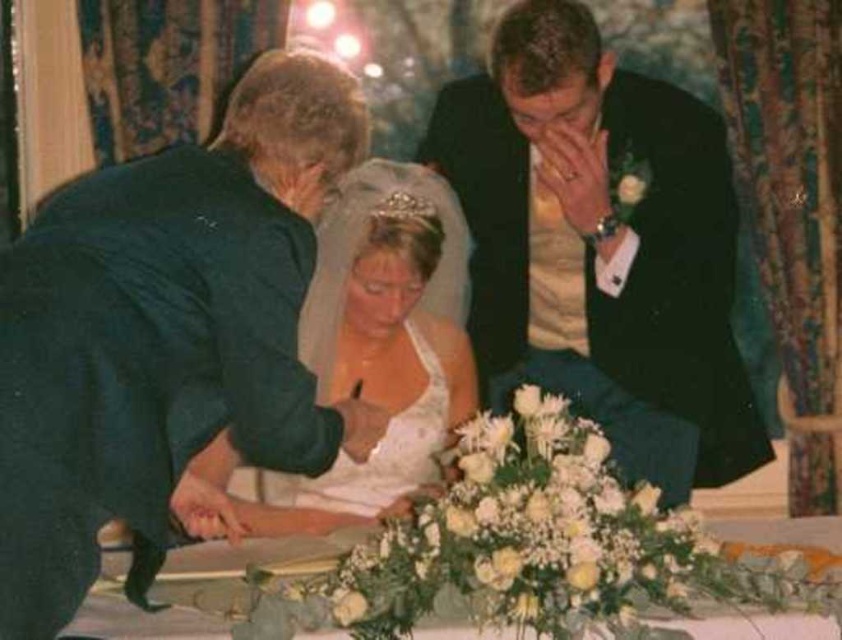
You are a photographer taking a picture of the wedding scene. You notice two points marked in the image at coordinates point [377,244] and point [372,461]. Which point is closer to your camera lens?

Point [377,244] is closer to the viewer than point [372,461].

You are a photographer at the wedding and need to adjust the lighting so that both the white satin dress at left and the white satin dress at center are equally illuminated. Given their height difference, which dress should you adjust the light to focus more on?

The white satin dress at left is much taller than the white satin dress at center, so you should focus more light on the white satin dress at center to ensure both are equally illuminated.

You are a photographer at the wedding and need to adjust the lighting so that the white satin dress at left and the white floral arrangement at center are both visible. Since they are both white, you need to know their positions to focus the light properly. According to the scene description, which object is closer to the camera?

The white satin dress at left is in front of the white floral arrangement at center, so it is closer to the camera.